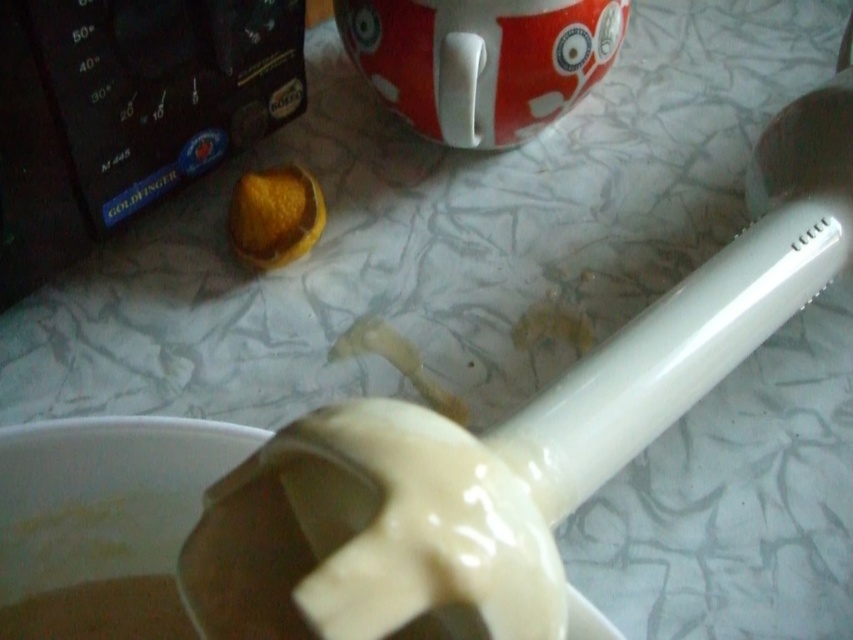
You are a chef preparing a dish and need to choose between the white glossy spoon at center and the orange peel at center to use as a tool. Which one is taller?

The white glossy spoon at center is taller than the orange peel at center.

You are a chef preparing a dish and need to place the orange peel at center on top of the white glossy spoon at center. Is the spoon already in the correct position to hold the orange peel?

The white glossy spoon at center is positioned under the orange peel at center, so yes, the spoon is already in the correct position to hold the orange peel.